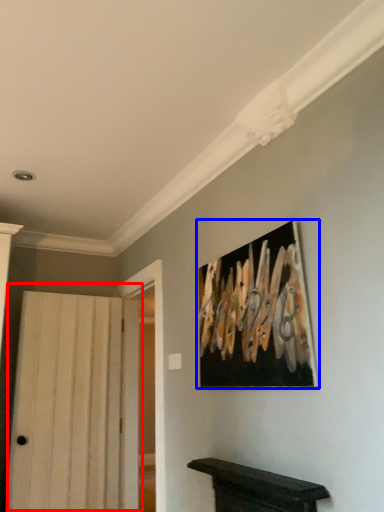
Question: Which object is closer to the camera taking this photo, door (highlighted by a red box) or picture frame (highlighted by a blue box)?

Choices:
 (A) door
 (B) picture frame

Answer: (B)